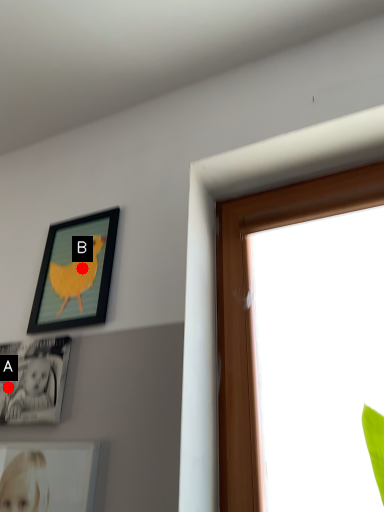
Question: Two points are circled on the image, labeled by A and B beside each circle. Among these points, which one is nearest to the camera?

Choices:
 (A) A is closer
 (B) B is closer

Answer: (A)